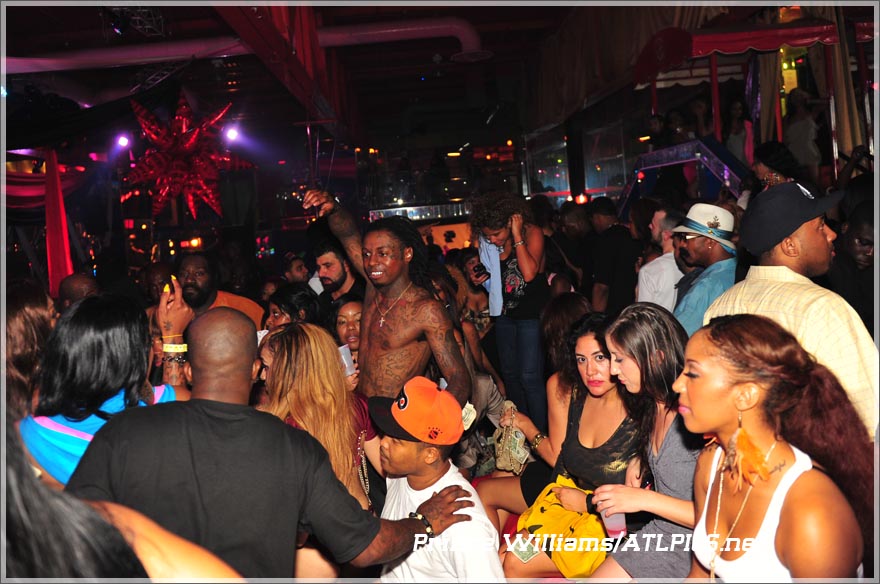
This screenshot has width=880, height=584. In order to click on ceiling in this screenshot , I will do `click(431, 41)`.